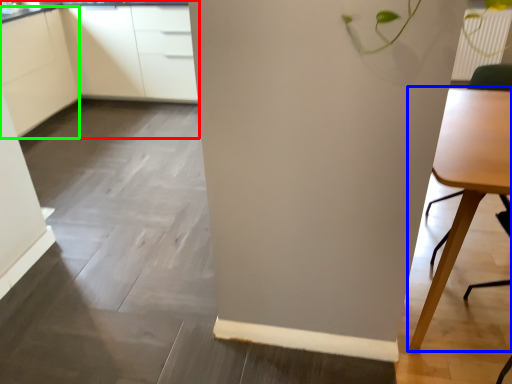
Question: Which object is the closest to the cabinetry (highlighted by a red box)? Choose among these: table (highlighted by a blue box) or cabinetry (highlighted by a green box).

Choices:
 (A) table
 (B) cabinetry

Answer: (B)